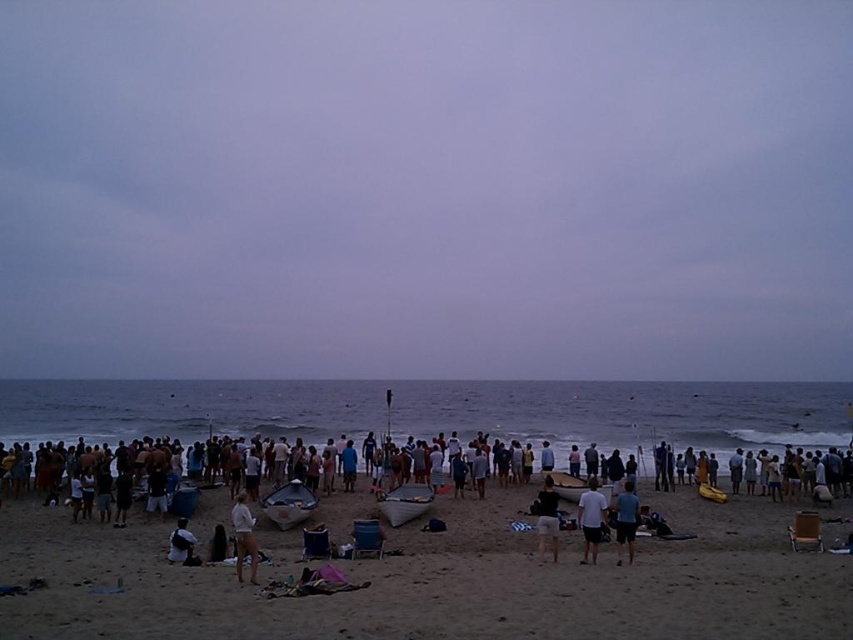
Question: Which of the following is the farthest from the observer?

Choices:
 (A) black fabric person at center
 (B) wooden boat at center
 (C) white cotton shirt at lower left

Answer: (B)

Question: Considering the relative positions of white fabric at center and white cotton shirt at lower left in the image provided, where is white fabric at center located with respect to white cotton shirt at lower left?

Choices:
 (A) left
 (B) right

Answer: (B)

Question: Is black fabric person at center positioned in front of white cotton shirt at lower left?

Choices:
 (A) yes
 (B) no

Answer: (A)

Question: Which point appears closest to the camera in this image?

Choices:
 (A) (621, 508)
 (B) (554, 518)
 (C) (393, 525)
 (D) (404, 529)

Answer: (A)

Question: Is sandy beach at center to the left of white cotton shirt at lower left from the viewer's perspective?

Choices:
 (A) no
 (B) yes

Answer: (A)

Question: Which of the following is the farthest from the observer?

Choices:
 (A) shiny metallic boat at center
 (B) blue fabric shorts at center
 (C) sandy beach at center

Answer: (A)